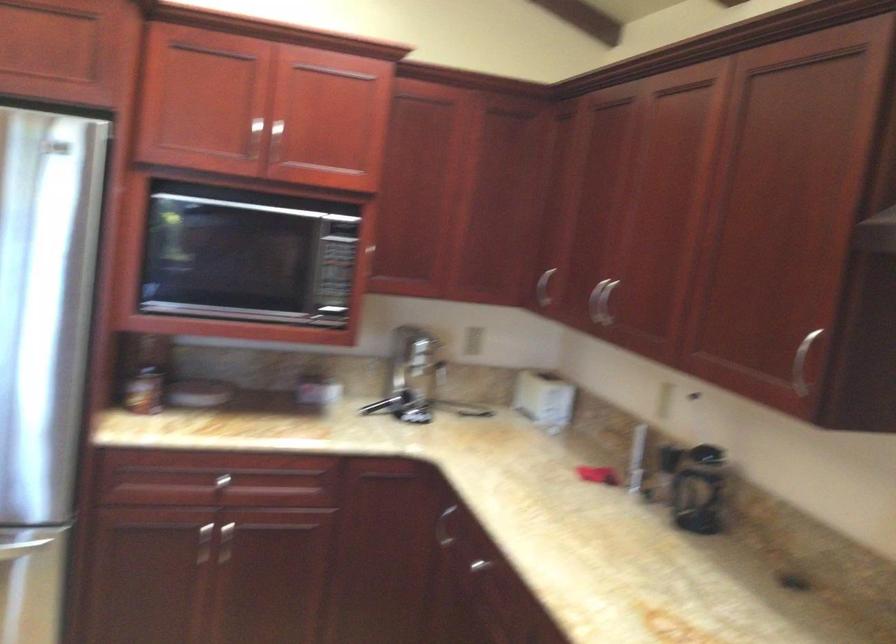
Where would you lift the brown jar? Please return your answer as a coordinate pair (x, y).

(699, 489)